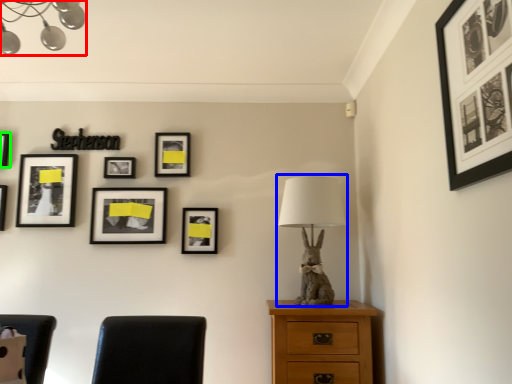
Question: Which is nearer to the lamp (highlighted by a red box)? table lamp (highlighted by a blue box) or picture frame (highlighted by a green box).

Choices:
 (A) table lamp
 (B) picture frame

Answer: (B)